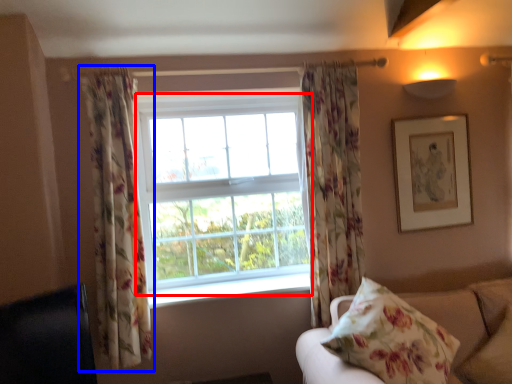
Question: Which object is further to the camera taking this photo, bay window (highlighted by a red box) or curtain (highlighted by a blue box)?

Choices:
 (A) bay window
 (B) curtain

Answer: (A)